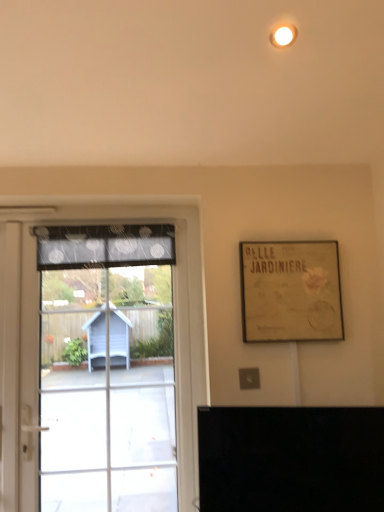
Describe the element at coordinates (113, 373) in the screenshot. The image size is (384, 512). I see `transparent glass door at left` at that location.

Identify the location of gold textured paper at upper right. (290, 291).

Is point (91, 256) closer or farther from the camera than point (317, 320)?

Point (91, 256).

Consider the image. From a real-world perspective, between dark gray sheer curtain at left and gold textured paper at upper right, who is vertically higher?

dark gray sheer curtain at left.

From their relative heights in the image, would you say dark gray sheer curtain at left is taller or shorter than gold textured paper at upper right?

Considering their sizes, dark gray sheer curtain at left has less height than gold textured paper at upper right.

Considering the positions of objects transparent glass door at left and black glossy tv at lower center in the image provided, who is behind, transparent glass door at left or black glossy tv at lower center?

transparent glass door at left is further away from the camera.

Could you tell me if transparent glass door at left is turned towards black glossy tv at lower center?

No, transparent glass door at left is not facing towards black glossy tv at lower center.

Is black glossy tv at lower center inside transparent glass door at left?

Definitely not — black glossy tv at lower center is not inside transparent glass door at left.

Does transparent glass door at left have a greater width compared to black glossy tv at lower center?

Yes.

From a real-world perspective, relative to transparent glass door at left, is gold textured paper at upper right vertically above or below?

From a real-world perspective, gold textured paper at upper right is physically above transparent glass door at left.

This screenshot has width=384, height=512. In order to click on window below the gold textured paper at upper right (from a real-world perspective) in this screenshot , I will do `click(113, 373)`.

Considering the positions of objects gold textured paper at upper right and transparent glass door at left in the image provided, who is in front, gold textured paper at upper right or transparent glass door at left?

Positioned in front is gold textured paper at upper right.

How far apart are gold textured paper at upper right and black glossy tv at lower center?

They are 19.51 inches apart.

Is gold textured paper at upper right taller than black glossy tv at lower center?

Yes, gold textured paper at upper right is taller than black glossy tv at lower center.

Can we say gold textured paper at upper right lies outside black glossy tv at lower center?

Yes, gold textured paper at upper right is not within black glossy tv at lower center.

In the scene shown: From a real-world perspective, who is located lower, gold textured paper at upper right or black glossy tv at lower center?

black glossy tv at lower center is physically lower.

Which of these two, dark gray sheer curtain at left or transparent glass door at left, is thinner?

Thinner between the two is dark gray sheer curtain at left.

Is dark gray sheer curtain at left oriented away from transparent glass door at left?

Yes, transparent glass door at left is at the back of dark gray sheer curtain at left.

Is dark gray sheer curtain at left in front of or behind transparent glass door at left in the image?

Clearly, dark gray sheer curtain at left is behind transparent glass door at left.

Can you confirm if dark gray sheer curtain at left is shorter than transparent glass door at left?

Indeed, dark gray sheer curtain at left has a lesser height compared to transparent glass door at left.

Is transparent glass door at left far away from dark gray sheer curtain at left?

They are positioned close to each other.

Between transparent glass door at left and dark gray sheer curtain at left, which one has less height?

dark gray sheer curtain at left.

In the scene shown: Is transparent glass door at left positioned beyond the bounds of dark gray sheer curtain at left?

transparent glass door at left is positioned outside dark gray sheer curtain at left.

Is transparent glass door at left further to the viewer compared to dark gray sheer curtain at left?

No, the depth of transparent glass door at left is less than that of dark gray sheer curtain at left.

Does gold textured paper at upper right have a greater width compared to dark gray sheer curtain at left?

Incorrect, the width of gold textured paper at upper right does not surpass that of dark gray sheer curtain at left.

From the image's perspective, is gold textured paper at upper right beneath dark gray sheer curtain at left?

Yes, from the image's perspective, gold textured paper at upper right is beneath dark gray sheer curtain at left.

Does gold textured paper at upper right turn towards dark gray sheer curtain at left?

No, gold textured paper at upper right does not turn towards dark gray sheer curtain at left.

Based on the photo, does gold textured paper at upper right have a greater height compared to dark gray sheer curtain at left?

Indeed, gold textured paper at upper right has a greater height compared to dark gray sheer curtain at left.

Where is `picture frame lying below the dark gray sheer curtain at left (from the image's perspective)`? The image size is (384, 512). picture frame lying below the dark gray sheer curtain at left (from the image's perspective) is located at coordinates (290, 291).

Find the location of `furniture in front of the transparent glass door at left`. furniture in front of the transparent glass door at left is located at coordinates (291, 459).

From the picture: Estimate the real-world distances between objects in this image. Which object is further from black glossy tv at lower center, transparent glass door at left or dark gray sheer curtain at left?

dark gray sheer curtain at left is positioned further to the anchor black glossy tv at lower center.

Based on their spatial positions, is gold textured paper at upper right or black glossy tv at lower center closer to transparent glass door at left?

The object closer to transparent glass door at left is gold textured paper at upper right.

Based on their spatial positions, is dark gray sheer curtain at left or black glossy tv at lower center closer to gold textured paper at upper right?

The object closer to gold textured paper at upper right is black glossy tv at lower center.

Looking at this image, which object lies nearer to the anchor point transparent glass door at left, dark gray sheer curtain at left or black glossy tv at lower center?

dark gray sheer curtain at left is positioned closer to the anchor transparent glass door at left.

From the image, which object appears to be nearer to transparent glass door at left, dark gray sheer curtain at left or gold textured paper at upper right?

dark gray sheer curtain at left is positioned closer to the anchor transparent glass door at left.

Based on their spatial positions, is black glossy tv at lower center or gold textured paper at upper right closer to dark gray sheer curtain at left?

Based on the image, gold textured paper at upper right appears to be nearer to dark gray sheer curtain at left.

Based on their spatial positions, is black glossy tv at lower center or gold textured paper at upper right further from transparent glass door at left?

Based on the image, black glossy tv at lower center appears to be further to transparent glass door at left.

Which object lies nearer to the anchor point black glossy tv at lower center, transparent glass door at left or gold textured paper at upper right?

Among the two, gold textured paper at upper right is located nearer to black glossy tv at lower center.

Where is `furniture located between transparent glass door at left and gold textured paper at upper right in the left-right direction`? This screenshot has width=384, height=512. furniture located between transparent glass door at left and gold textured paper at upper right in the left-right direction is located at coordinates (291, 459).

Image resolution: width=384 pixels, height=512 pixels. In order to click on window located between dark gray sheer curtain at left and black glossy tv at lower center in the left-right direction in this screenshot , I will do `click(113, 373)`.

The height and width of the screenshot is (512, 384). In order to click on window situated between dark gray sheer curtain at left and gold textured paper at upper right from left to right in this screenshot , I will do `click(113, 373)`.

I want to click on furniture between dark gray sheer curtain at left and gold textured paper at upper right from left to right, so click(291, 459).